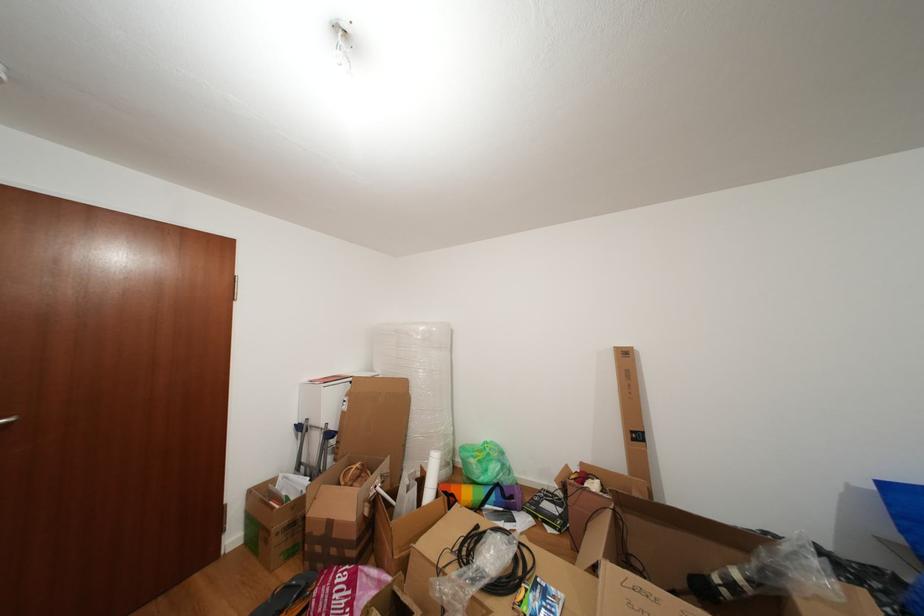
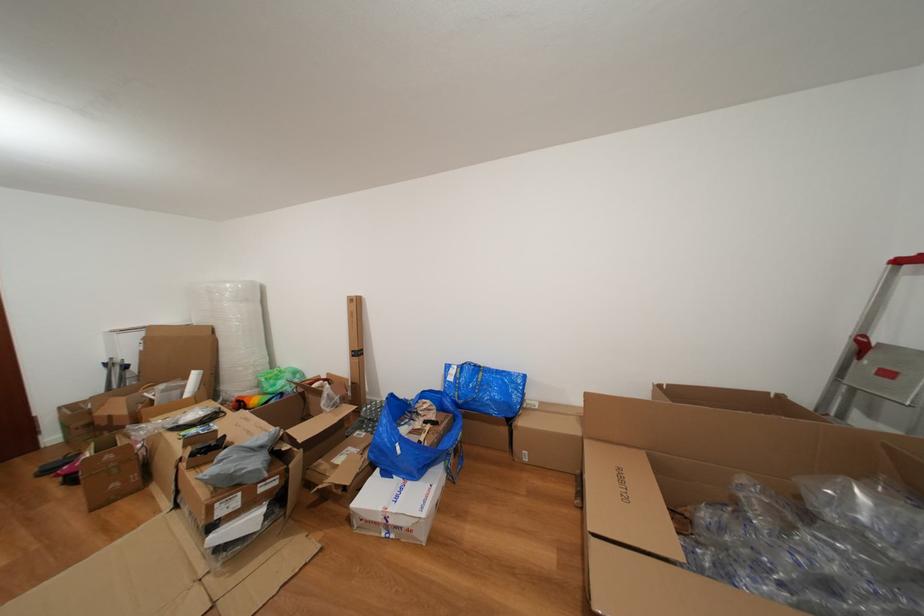
Find the pixel in the second image that matches [494,476] in the first image.

(283, 390)